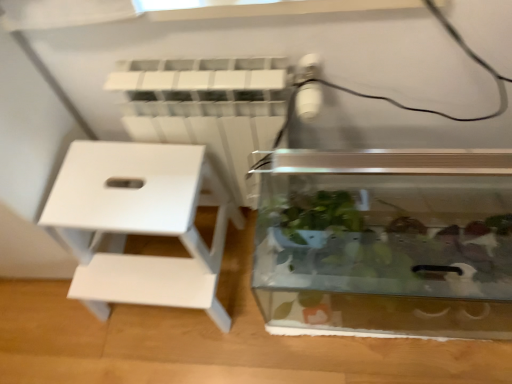
Where is `free spot above white plastic radiator at upper center (from a real-world perspective)`? The width and height of the screenshot is (512, 384). free spot above white plastic radiator at upper center (from a real-world perspective) is located at coordinates (206, 76).